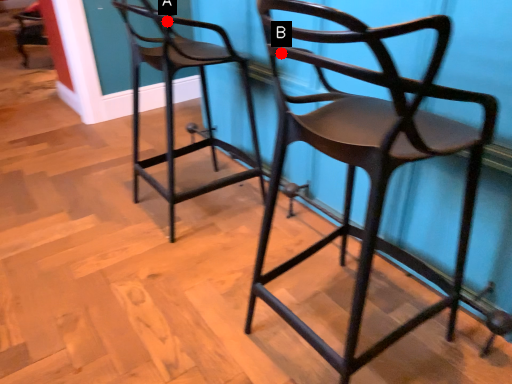
Question: Two points are circled on the image, labeled by A and B beside each circle. Which point is closer to the camera?

Choices:
 (A) A is closer
 (B) B is closer

Answer: (B)